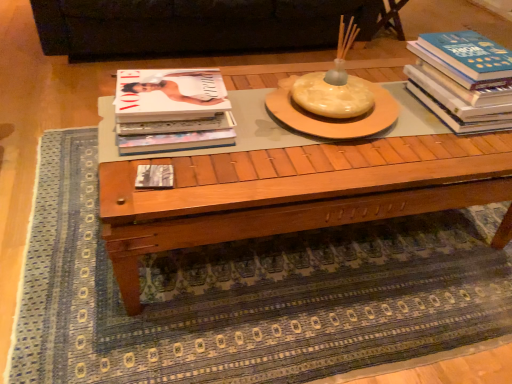
Where is `free space behind matte black book at center, arranged as the first book when viewed from the left`? The image size is (512, 384). free space behind matte black book at center, arranged as the first book when viewed from the left is located at coordinates (175, 157).